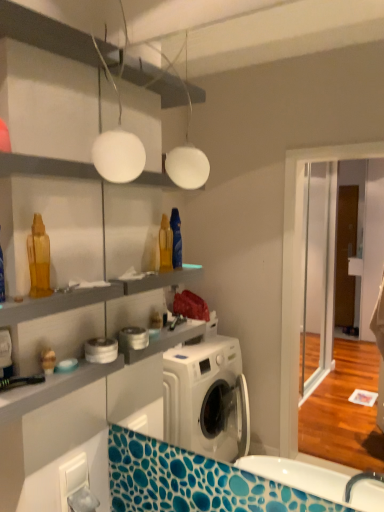
Question: Is white matte globe at upper center beside white glossy shelf at upper center?

Choices:
 (A) yes
 (B) no

Answer: (B)

Question: Can you confirm if white matte globe at upper center is wider than white glossy shelf at upper center?

Choices:
 (A) no
 (B) yes

Answer: (A)

Question: Is white matte globe at upper center turned away from white glossy shelf at upper center?

Choices:
 (A) no
 (B) yes

Answer: (A)

Question: Would you say white matte globe at upper center is outside white glossy shelf at upper center?

Choices:
 (A) no
 (B) yes

Answer: (B)

Question: From a real-world perspective, does white matte globe at upper center stand above white glossy shelf at upper center?

Choices:
 (A) no
 (B) yes

Answer: (B)

Question: From a real-world perspective, does white matte globe at upper center sit lower than white glossy shelf at upper center?

Choices:
 (A) yes
 (B) no

Answer: (B)

Question: Does white glossy shelf at upper center have a smaller size compared to white matte globe at upper center?

Choices:
 (A) yes
 (B) no

Answer: (B)

Question: Would you say white glossy shelf at upper center contains white matte globe at upper center?

Choices:
 (A) yes
 (B) no

Answer: (B)

Question: Is white glossy shelf at upper center directly adjacent to white matte globe at upper center?

Choices:
 (A) no
 (B) yes

Answer: (A)

Question: Is white glossy shelf at upper center bigger than white matte globe at upper center?

Choices:
 (A) yes
 (B) no

Answer: (A)

Question: From the image's perspective, does white glossy shelf at upper center appear lower than white matte globe at upper center?

Choices:
 (A) no
 (B) yes

Answer: (B)

Question: Would you say white glossy shelf at upper center is a long distance from white matte globe at upper center?

Choices:
 (A) yes
 (B) no

Answer: (B)

Question: Considering the relative positions of white glossy shelf at upper center and matte plastic toy at lower left in the image provided, is white glossy shelf at upper center behind matte plastic toy at lower left?

Choices:
 (A) no
 (B) yes

Answer: (A)